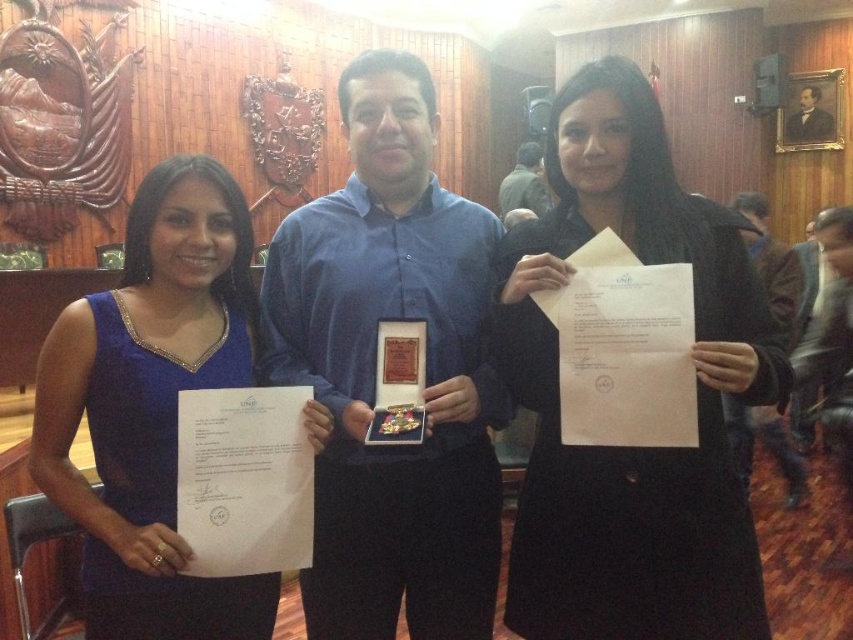
Measure the distance from black matte coat at center to green fabric shirt at center.

They are 4.18 meters apart.

Image resolution: width=853 pixels, height=640 pixels. Find the location of `black matte coat at center`. black matte coat at center is located at coordinates (634, 448).

Measure the distance between brown leather jacket at right and camera.

3.52 meters

Does brown leather jacket at right have a lesser height compared to green fabric shirt at center?

Correct, brown leather jacket at right is not as tall as green fabric shirt at center.

Between point (726, 428) and point (538, 150), which one is positioned behind?

The point (538, 150) is behind.

Locate an element on the screen. This screenshot has width=853, height=640. brown leather jacket at right is located at coordinates (770, 260).

Is blue shirt at center wider than blue satin dress at left?

No, blue shirt at center is not wider than blue satin dress at left.

Can you confirm if blue shirt at center is positioned above blue satin dress at left?

Yes, blue shirt at center is above blue satin dress at left.

The width and height of the screenshot is (853, 640). What are the coordinates of `blue shirt at center` in the screenshot? It's located at (374, 371).